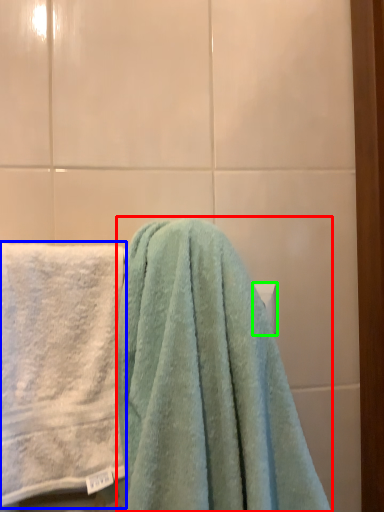
Question: Considering the real-world distances, which object is closest to towel (highlighted by a red box)? towel (highlighted by a blue box) or towel bar (highlighted by a green box).

Choices:
 (A) towel
 (B) towel bar

Answer: (A)